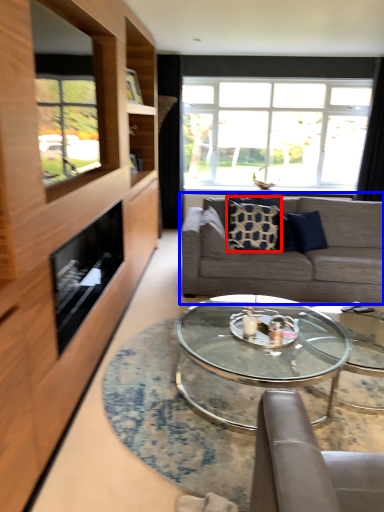
Question: Which point is further to the camera, pillow (highlighted by a red box) or studio couch (highlighted by a blue box)?

Choices:
 (A) pillow
 (B) studio couch

Answer: (A)